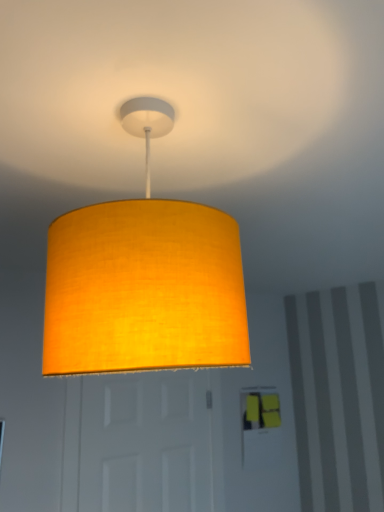
Question: Can you confirm if matte yellow fabric lampshade at upper center is taller than white matte door at center?

Choices:
 (A) no
 (B) yes

Answer: (A)

Question: Does matte yellow fabric lampshade at upper center have a lesser width compared to white matte door at center?

Choices:
 (A) no
 (B) yes

Answer: (A)

Question: Considering the relative sizes of matte yellow fabric lampshade at upper center and white matte door at center in the image provided, is matte yellow fabric lampshade at upper center wider than white matte door at center?

Choices:
 (A) no
 (B) yes

Answer: (B)

Question: Is matte yellow fabric lampshade at upper center located outside white matte door at center?

Choices:
 (A) yes
 (B) no

Answer: (A)

Question: Does matte yellow fabric lampshade at upper center have a larger size compared to white matte door at center?

Choices:
 (A) no
 (B) yes

Answer: (A)

Question: Is matte yellow fabric lampshade at upper center surrounding white matte door at center?

Choices:
 (A) no
 (B) yes

Answer: (A)

Question: Does white matte door at center have a larger size compared to matte yellow fabric lampshade at upper center?

Choices:
 (A) no
 (B) yes

Answer: (B)

Question: Is white matte door at center not near matte yellow fabric lampshade at upper center?

Choices:
 (A) yes
 (B) no

Answer: (A)

Question: Considering the relative sizes of white matte door at center and matte yellow fabric lampshade at upper center in the image provided, is white matte door at center thinner than matte yellow fabric lampshade at upper center?

Choices:
 (A) no
 (B) yes

Answer: (B)

Question: Can you confirm if white matte door at center is smaller than matte yellow fabric lampshade at upper center?

Choices:
 (A) yes
 (B) no

Answer: (B)

Question: From a real-world perspective, is white matte door at center positioned over matte yellow fabric lampshade at upper center based on gravity?

Choices:
 (A) yes
 (B) no

Answer: (B)

Question: From the image's perspective, is white matte door at center over matte yellow fabric lampshade at upper center?

Choices:
 (A) yes
 (B) no

Answer: (B)

Question: Is white matte door at center taller or shorter than matte yellow fabric lampshade at upper center?

Choices:
 (A) short
 (B) tall

Answer: (B)